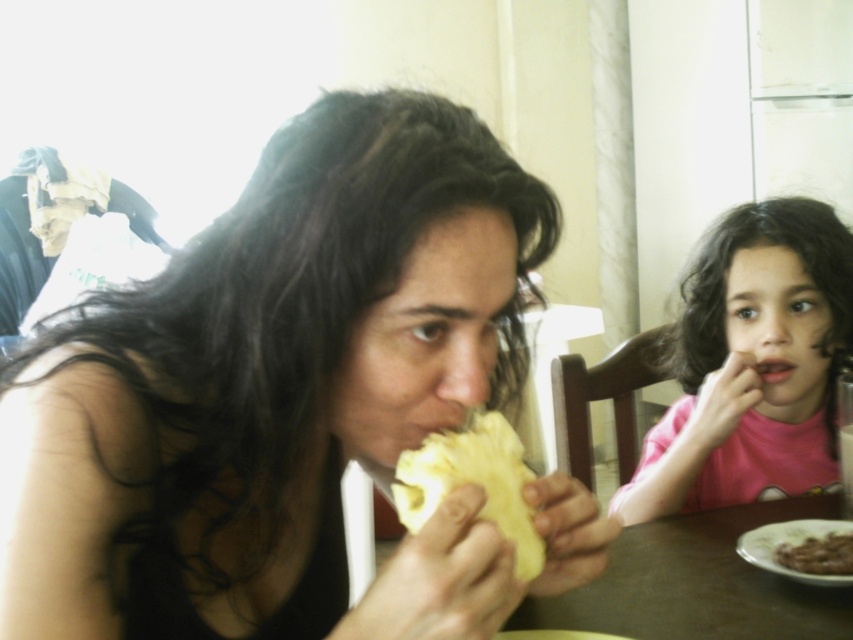
You are a waiter who needs to place a dessert menu on the table. The menu is 4 inches wide. Can you fit it between the brown wooden table at lower center and the brown crumbly cake at lower right without overlapping anything?

The brown wooden table at lower center is 4.45 inches from the brown crumbly cake at lower right. Since the dessert menu is 4 inches wide, it can fit between them as the distance is slightly larger than the menu width.

You are a chef preparing to serve a meal and notice the yellow matte bread at center and the pink matte shirt at upper right on the table. Which item has a greater width?

The yellow matte bread at center has a greater width than the pink matte shirt at upper right.

You are standing in the dining area and want to place a new decorative item on the brown wooden table at lower center. According to the image, where exactly should you position it?

The brown wooden table at lower center is located at coordinates point (698,582), so you should position the decorative item there.